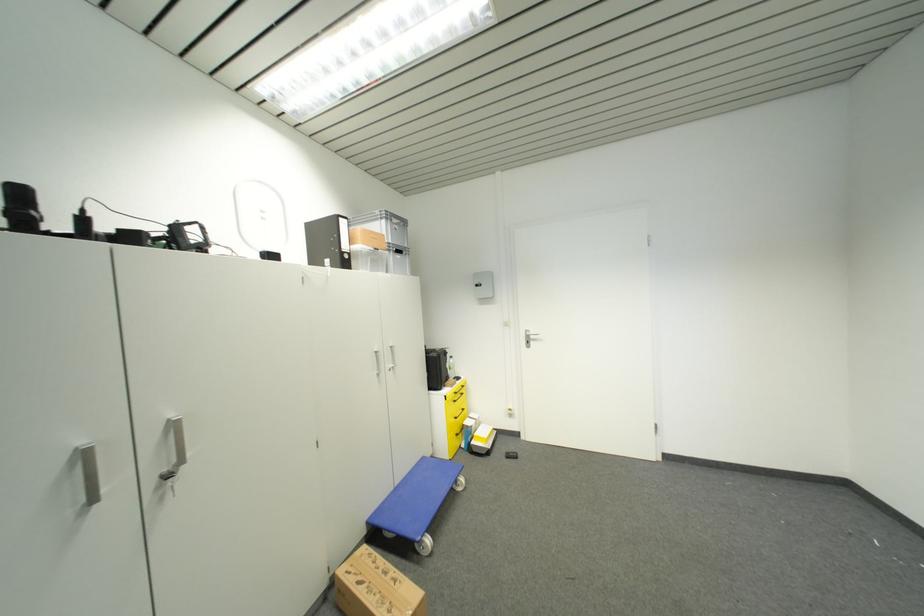
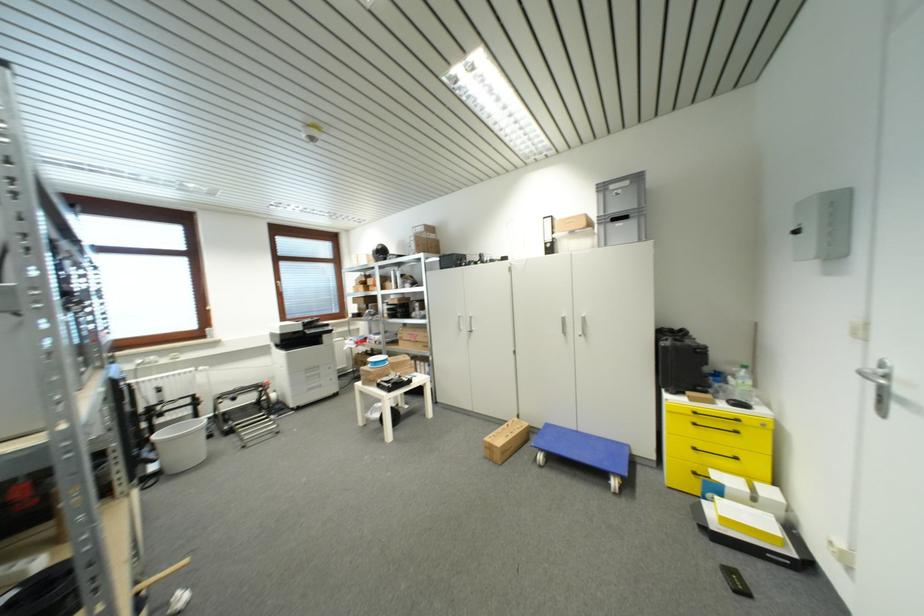
Find the pixel in the second image that matches pixel 398 223 in the first image.

(616, 190)